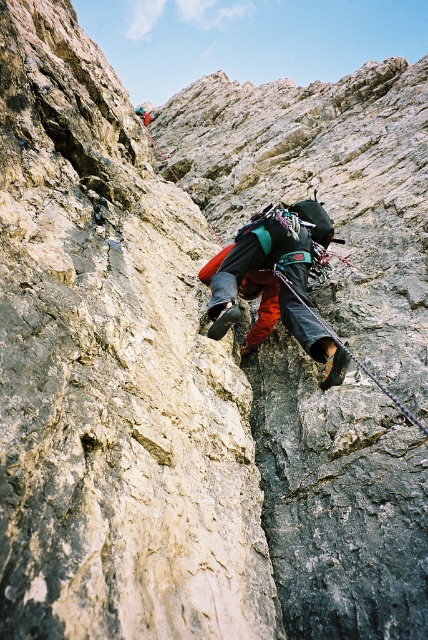
You are a rock climber preparing to ascend a steep cliff. You notice the multicolored climbing gear at center and the black nylon rope at center. Which item is closer to your face as you look straight ahead?

The multicolored climbing gear at center is closer to your face because it is positioned further to the viewer than the black nylon rope at center.

You are a rock climber preparing to secure your equipment. You have two items at the center of your view, the multicolored climbing gear at center and the black nylon rope at center. Which item is narrower in width?

The multicolored climbing gear at center has a lesser width compared to black nylon rope at center, so the multicolored climbing gear at center is narrower.